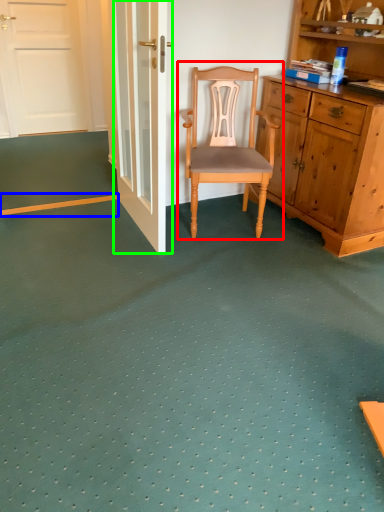
Question: Which object is positioned closest to chair (highlighted by a red box)? Select from strip (highlighted by a blue box) and door (highlighted by a green box).

Choices:
 (A) strip
 (B) door

Answer: (B)